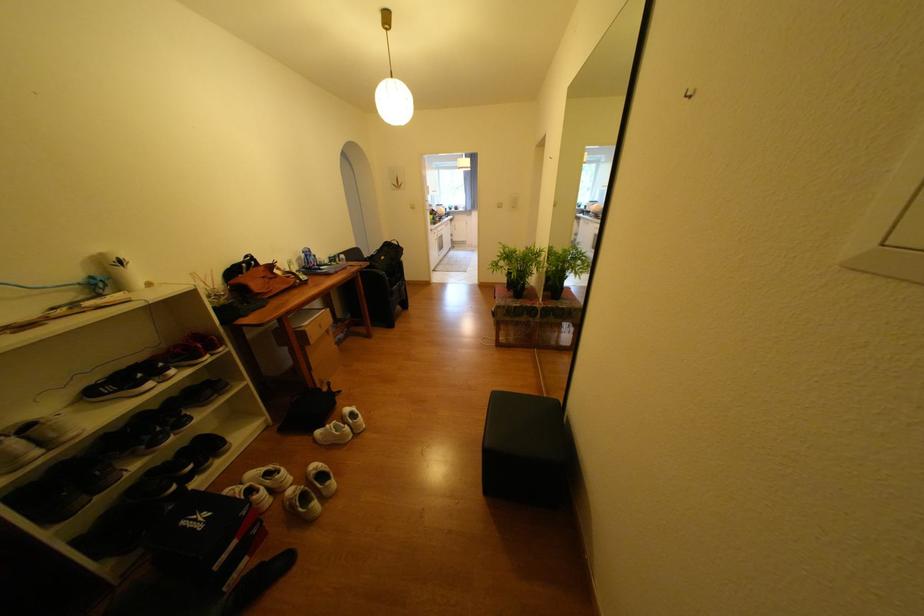
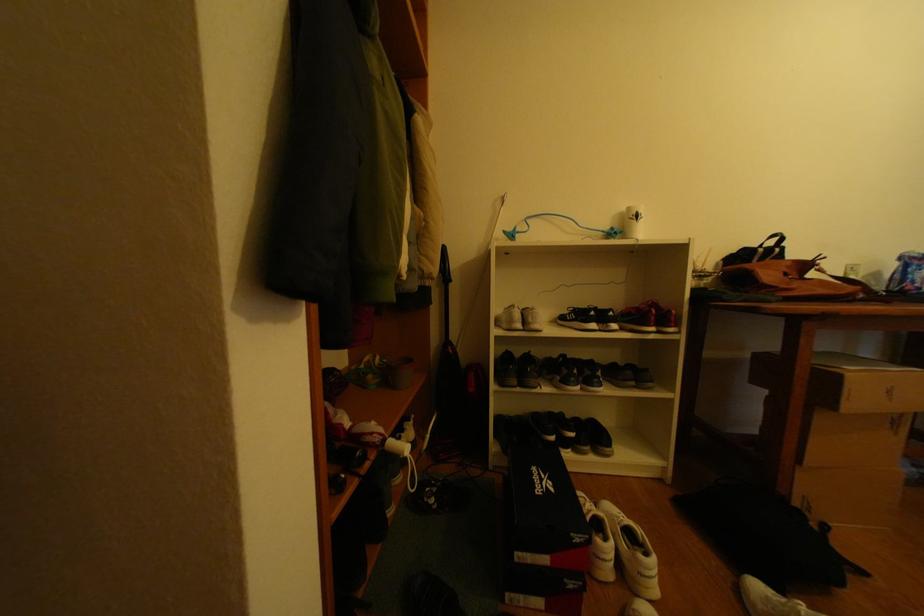
Question: The camera is either moving clockwise (left) or counter-clockwise (right) around the object. The first image is from the beginning of the video and the second image is from the end. Is the camera moving left or right when shooting the video?

Choices:
 (A) Left
 (B) Right

Answer: (B)